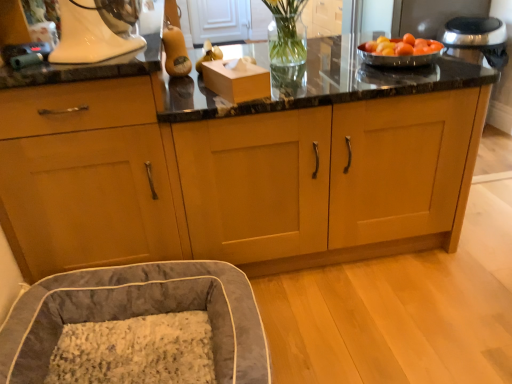
You are a GUI agent. You are given a task and a screenshot of the screen. Output one action in this format:
    pyautogui.click(x=<x>, y=<y>)
    Task: Click on the vacant area that is situated to the right of velvet gray bean bag at lower left
    
    Given the screenshot: What is the action you would take?
    pyautogui.click(x=337, y=322)